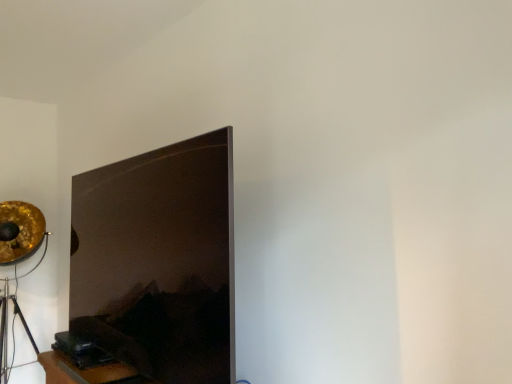
Image resolution: width=512 pixels, height=384 pixels. Describe the element at coordinates (159, 261) in the screenshot. I see `matte black fireplace at upper left` at that location.

Measure the distance between matte black fireplace at upper left and camera.

3.89 feet.

Where is `matte black fireplace at upper left`? matte black fireplace at upper left is located at coordinates [x=159, y=261].

Locate an element on the screen. The image size is (512, 384). matte black fireplace at upper left is located at coordinates (159, 261).